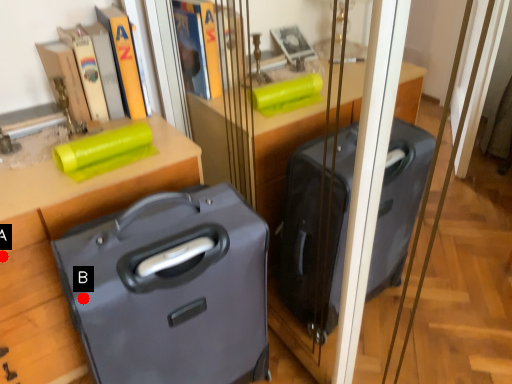
Question: Two points are circled on the image, labeled by A and B beside each circle. Which point is farther to the camera?

Choices:
 (A) A is further
 (B) B is further

Answer: (A)